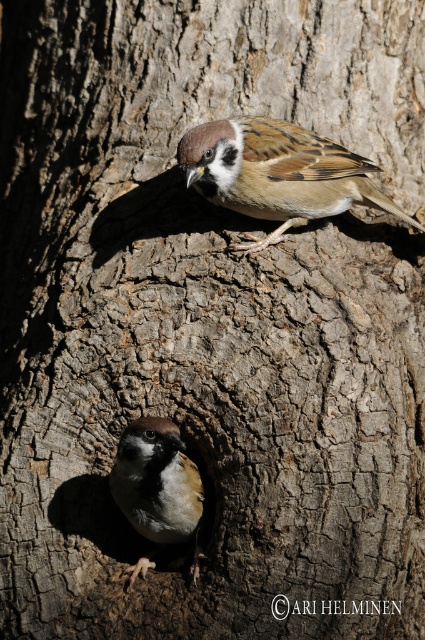
You are observing two points marked on a tree trunk. The first point is at coordinates point [334,156], and the second is at point [161,435]. From your perspective, which point is closer to you?

Point [161,435] is closer to you because it is in front of point [334,156].

You are a birdwatcher trying to capture a photo of both the brown speckled sparrow at upper center and the brown feathered sparrow at lower left. Your camera has a zoom lens that can focus on objects within a 30 inch range. Can you capture both birds in a single photo without moving the camera?

The distance between the brown speckled sparrow at upper center and the brown feathered sparrow at lower left is 28.08 inches, which is within the 30 inch range of your camera lens. Therefore, you can capture both birds in a single photo without moving the camera.

You are a photographer aiming to capture a closeup of the brown speckled sparrow at upper center. Your camera lens has a minimum focusing distance of 2 meters. Can you take a clear photo without moving the camera?

The distance between the brown speckled sparrow at upper center and the camera is 2.05 meters, which is slightly beyond the lens minimum focusing distance of 2 meters. Therefore, the camera cannot focus clearly on the brown speckled sparrow at upper center without moving closer.